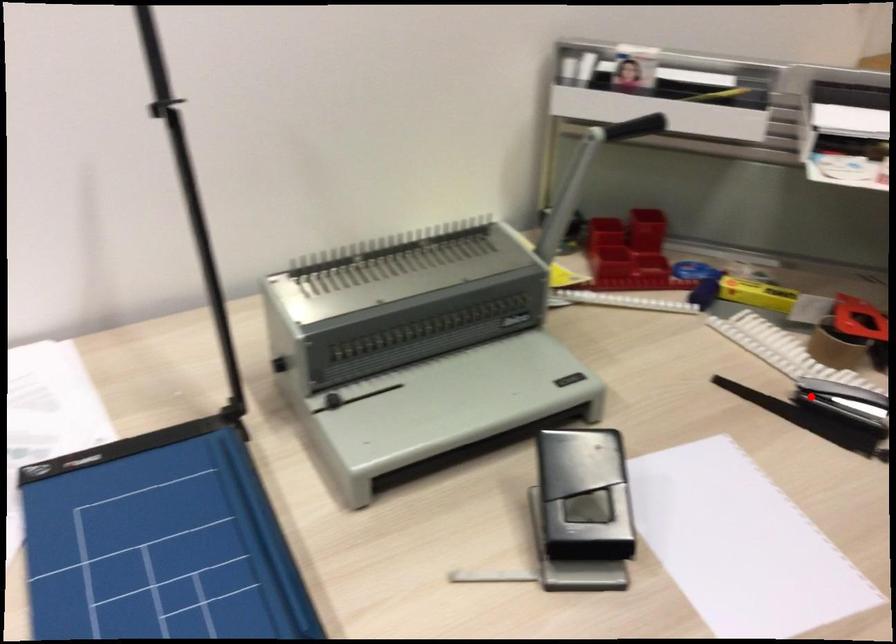
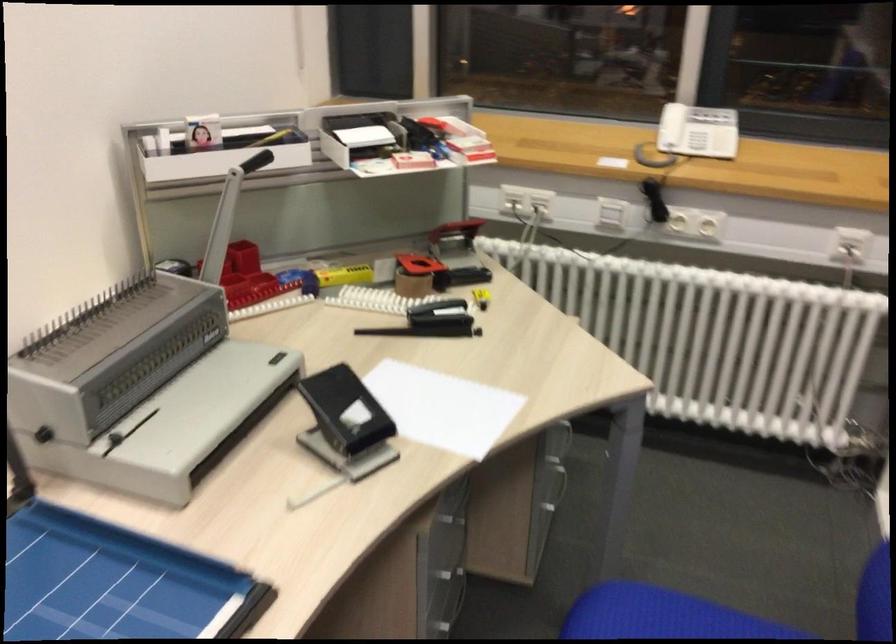
The point at the highlighted location is marked in the first image. Where is the corresponding point in the second image?

(431, 321)